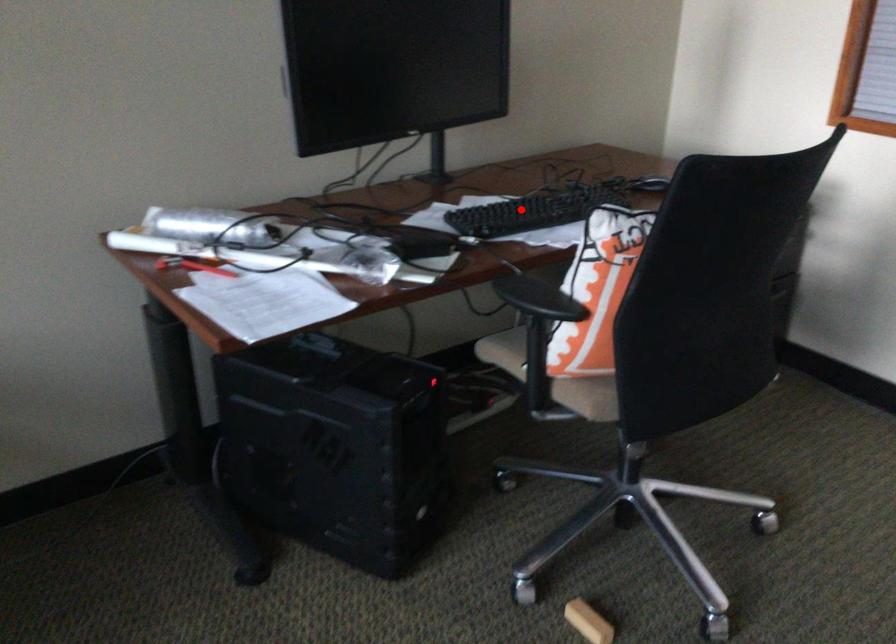
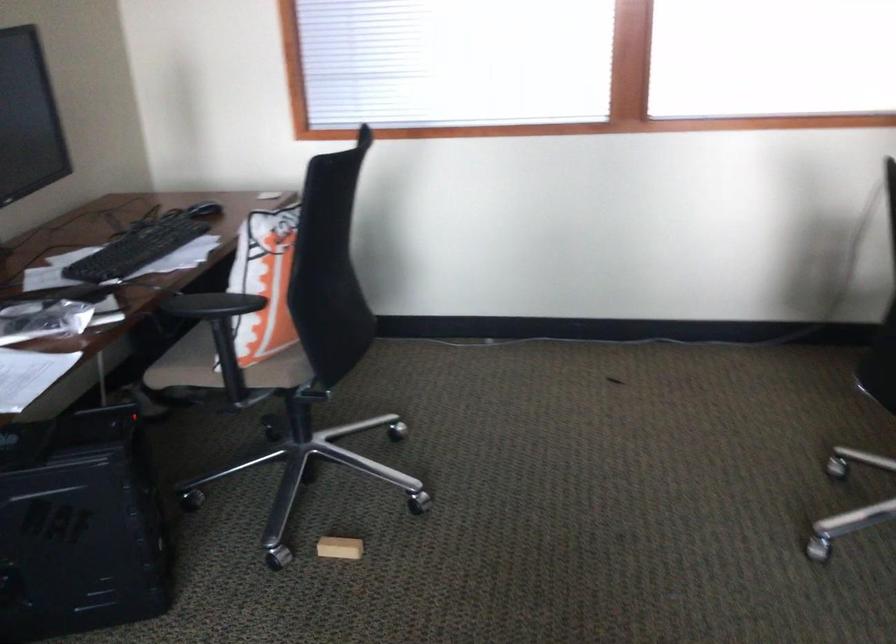
Question: I am providing you with two images of the same scene from different viewpoints. A red point is marked on the first image. Is the red point's position out of view in image 2?

Choices:
 (A) Yes
 (B) No

Answer: (B)